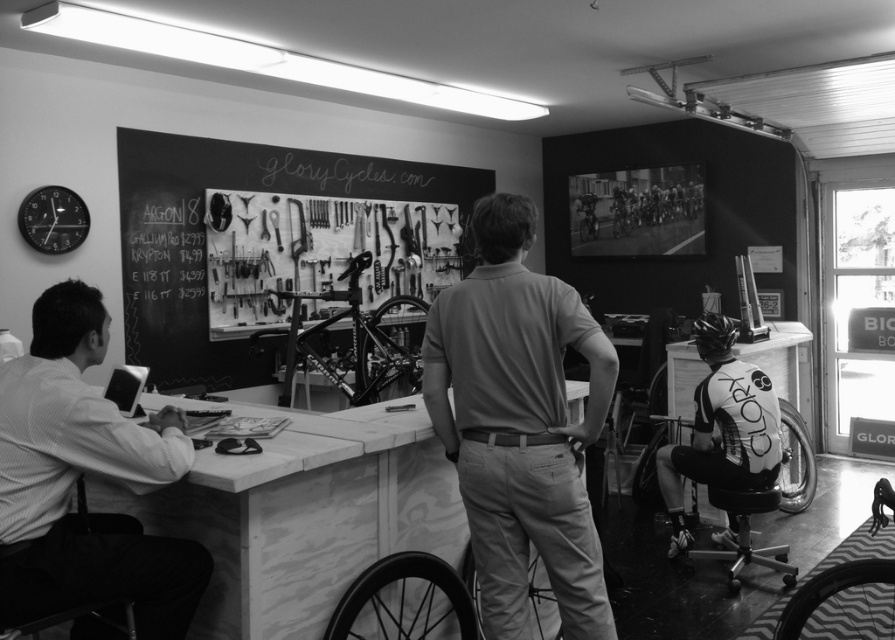
Is chalkboard with tools at center to the right of white jersey at center from the viewer's perspective?

Incorrect, chalkboard with tools at center is not on the right side of white jersey at center.

Is point (423, 198) closer to viewer compared to point (695, 396)?

No.

The height and width of the screenshot is (640, 895). Identify the location of chalkboard with tools at center. (203, 236).

Does smooth beige polo shirt at center appear on the left side of white shirt at left?

In fact, smooth beige polo shirt at center is to the right of white shirt at left.

Is smooth beige polo shirt at center to the right of white shirt at left from the viewer's perspective?

Indeed, smooth beige polo shirt at center is positioned on the right side of white shirt at left.

Is point (497, 269) closer to viewer compared to point (74, 380)?

No, (497, 269) is behind (74, 380).

This screenshot has height=640, width=895. In order to click on smooth beige polo shirt at center in this screenshot , I will do `click(518, 424)`.

Can you confirm if white shirt at left is wider than white jersey at center?

Correct, the width of white shirt at left exceeds that of white jersey at center.

Which of these two, white shirt at left or white jersey at center, stands shorter?

With less height is white shirt at left.

The image size is (895, 640). What are the coordinates of `white shirt at left` in the screenshot? It's located at (81, 472).